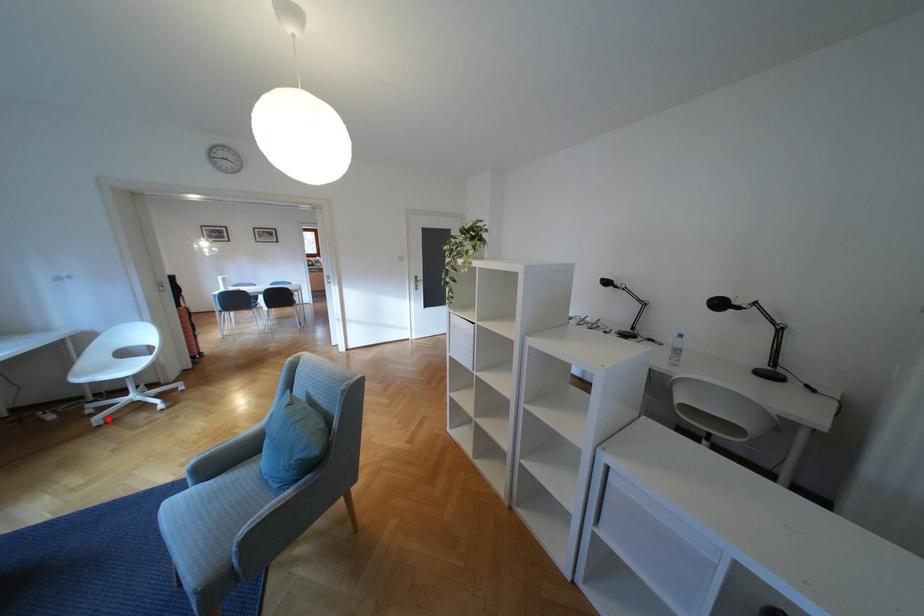
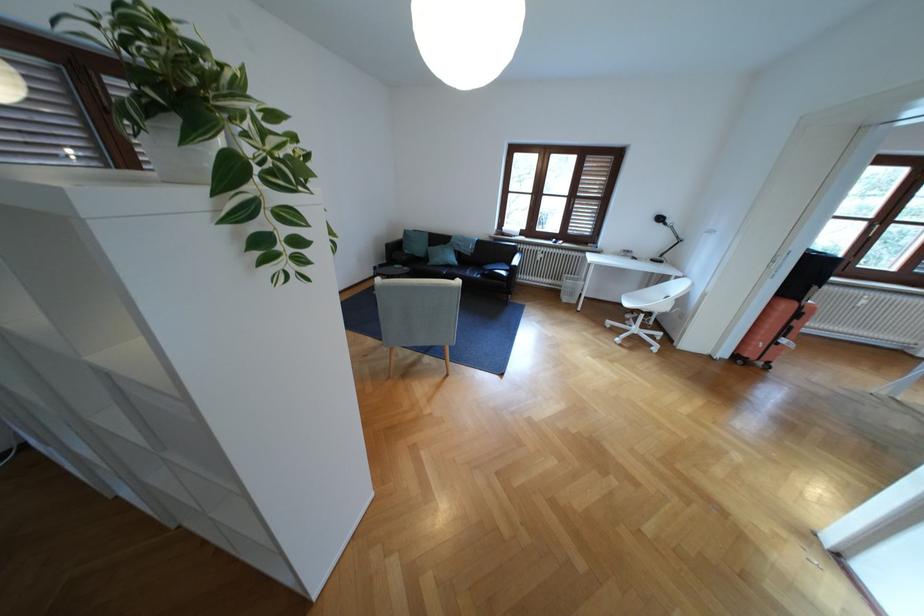
The point at the highlighted location is marked in the first image. Where is the corresponding point in the second image?

(618, 323)